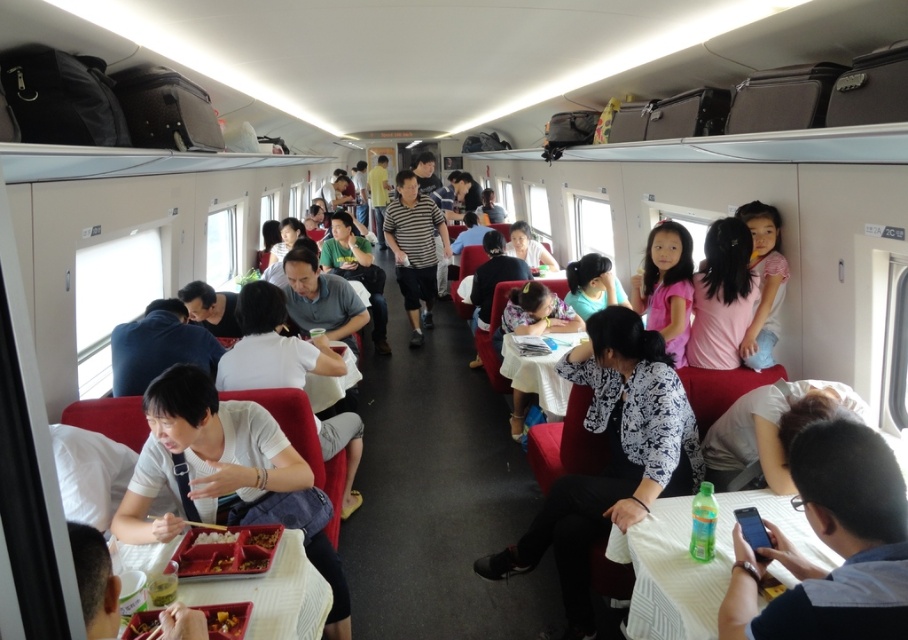
Question: Which object is closer to the camera taking this photo?

Choices:
 (A) shiny plastic container at lower left
 (B) matte plastic tray at lower center
 (C) matte gray shirt at center
 (D) brown matte food at center

Answer: (C)

Question: Considering the real-world distances, which object is closest to the matte gray shirt at center?

Choices:
 (A) white glossy chopsticks at lower center
 (B) pink cotton shirt at upper right
 (C) plastic red bento box at lower left

Answer: (C)

Question: Is pink satin dress at center to the right of brown matte food at lower center from the viewer's perspective?

Choices:
 (A) yes
 (B) no

Answer: (A)

Question: Estimate the real-world distances between objects in this image. Which object is closer to the pink cotton shirt at upper right?

Choices:
 (A) shiny plastic container at lower left
 (B) white printed blouse at center

Answer: (B)

Question: Is matte gray shirt at center further to the viewer compared to brown matte food at center?

Choices:
 (A) no
 (B) yes

Answer: (A)

Question: Does pink cotton shirt at upper right appear under brown matte food at center?

Choices:
 (A) no
 (B) yes

Answer: (A)